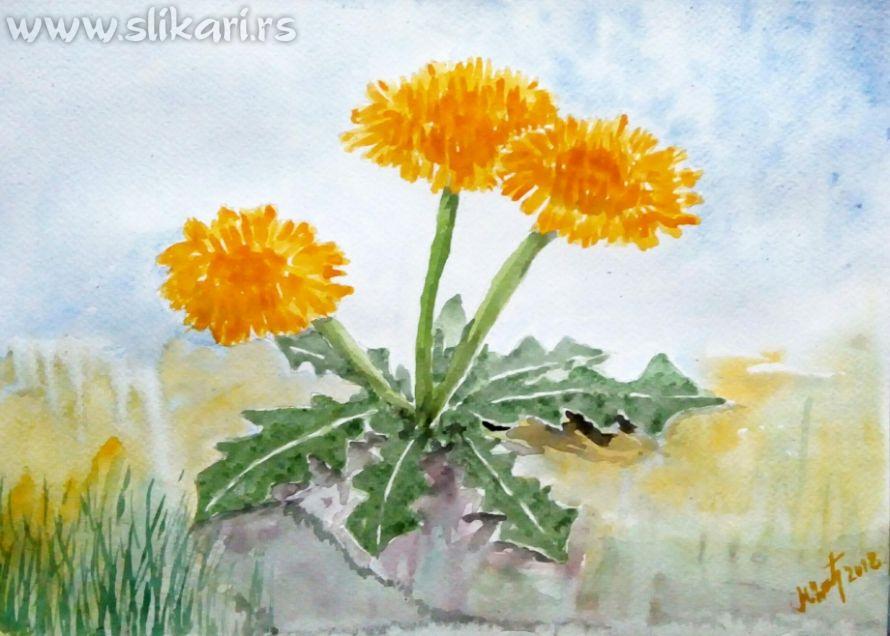
Image resolution: width=890 pixels, height=636 pixels. In order to click on painting in this screenshot , I will do `click(465, 349)`.